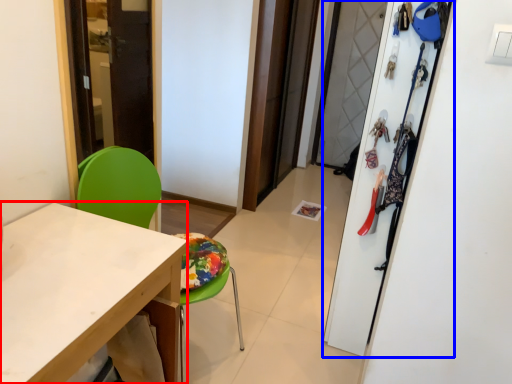
Question: Which of the following is the farthest to the observer, desk (highlighted by a red box) or closet (highlighted by a blue box)?

Choices:
 (A) desk
 (B) closet

Answer: (B)